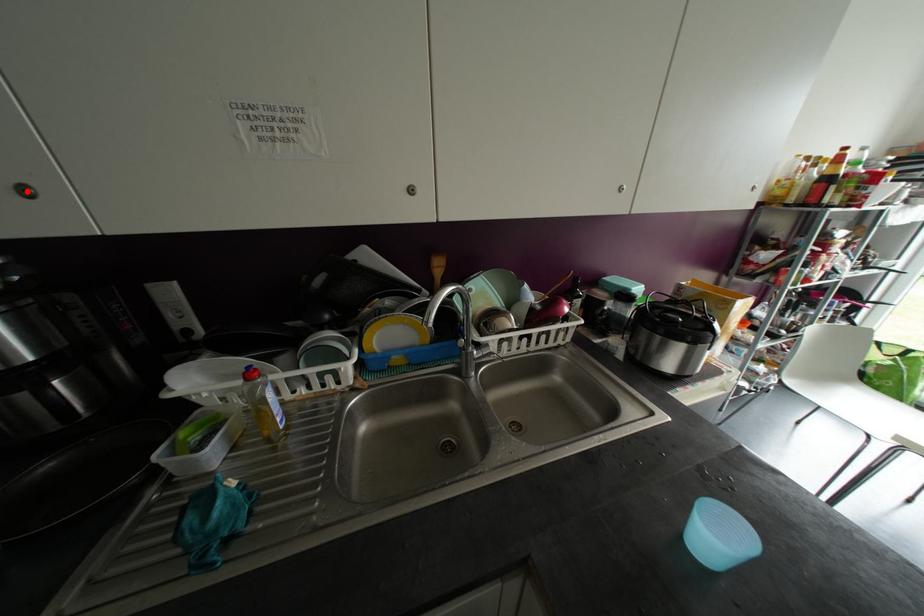
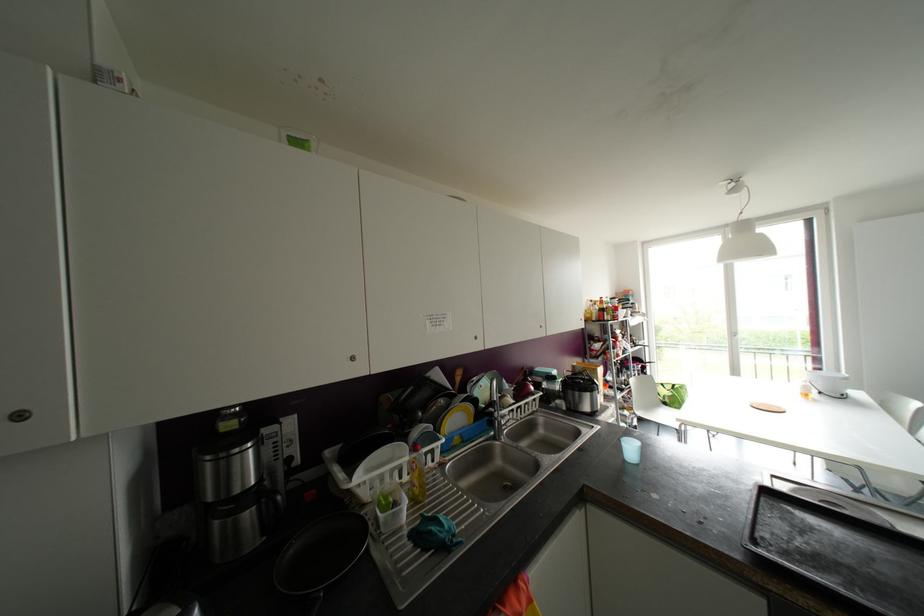
Locate, in the second image, the point that corresponds to the highlighted location in the first image.

(351, 358)